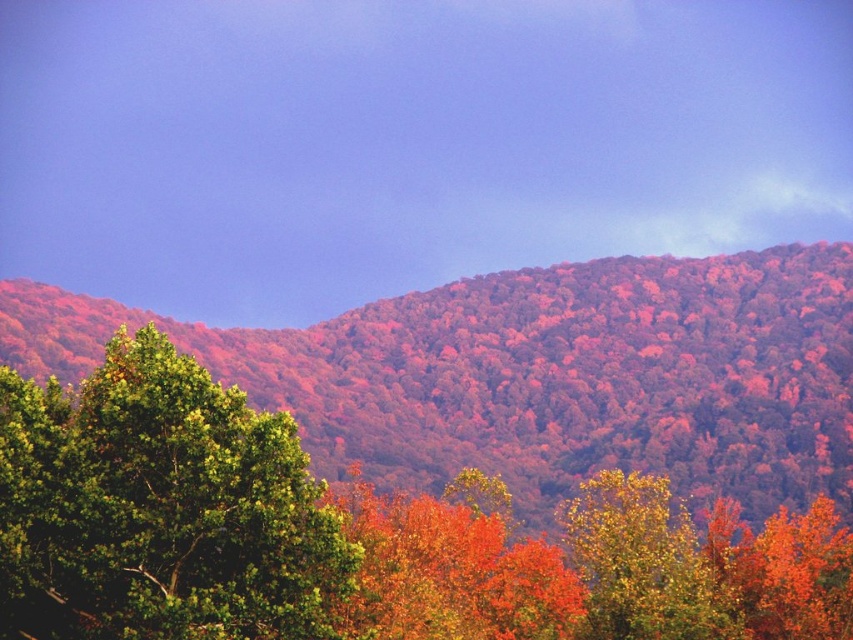
Can you confirm if green matte tree at lower left is positioned to the right of golden yellow leaves at center?

In fact, green matte tree at lower left is to the left of golden yellow leaves at center.

Where is `green matte tree at lower left`? green matte tree at lower left is located at coordinates (160, 509).

Between point (660, 310) and point (729, 621), which one is positioned in front?

Point (729, 621) is more forward.

The width and height of the screenshot is (853, 640). What do you see at coordinates (540, 374) in the screenshot?
I see `autumn leaves at center` at bounding box center [540, 374].

This screenshot has width=853, height=640. Find the location of `autumn leaves at center`. autumn leaves at center is located at coordinates (540, 374).

Which of these two, autumn leaves at center or green matte tree at lower left, stands taller?

autumn leaves at center

Which is more to the left, autumn leaves at center or green matte tree at lower left?

Positioned to the left is green matte tree at lower left.

Which is in front, point (769, 314) or point (97, 568)?

Point (97, 568) is more forward.

In order to click on autumn leaves at center in this screenshot , I will do `click(540, 374)`.